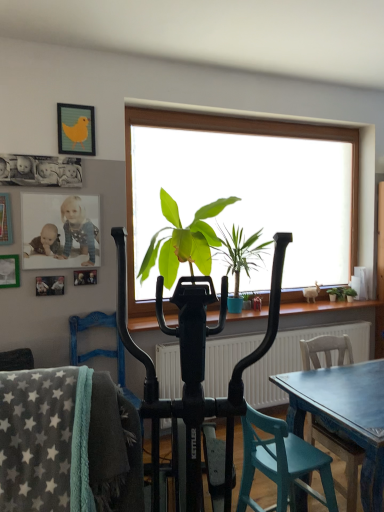
Question: Is green leafy plant at right, the 1th houseplant from the right, inside or outside of matte green picture frame at upper left, which ranks as the first picture frame in bottom-to-top order?

Choices:
 (A) inside
 (B) outside

Answer: (B)

Question: Based on their sizes in the image, would you say green leafy plant at right, which is counted as the 3th houseplant, starting from the left, is bigger or smaller than matte green picture frame at upper left, which is counted as the 4th picture frame, starting from the top?

Choices:
 (A) small
 (B) big

Answer: (B)

Question: Which object is positioned farthest from the matte green picture frame at upper left, which ranks as the first picture frame in bottom-to-top order?

Choices:
 (A) wooden chair at lower right, which is the 1th chair from back to front
 (B) gray fleece blanket at lower left, placed as the 1th chair when sorted from front to back
 (C) green leafy plant at right, which is counted as the 3th houseplant, starting from the left
 (D) green leafy plant at center, the second houseplant viewed from the right
 (E) teal wood chair at lower right, the second chair when ordered from front to back

Answer: (C)

Question: Which is nearer to the green leafy plant at center, the first houseplant in the left-to-right sequence?

Choices:
 (A) matte plastic photo frame at upper left, the 3th picture frame when ordered from top to bottom
 (B) yellow fabric picture frame at upper left, acting as the fourth picture frame starting from the bottom
 (C) wooden picture frame at upper left, the 3th picture frame from the bottom
 (D) green leafy plant at right, the 1th houseplant from the right
 (E) black plastic exercise bike at center

Answer: (A)